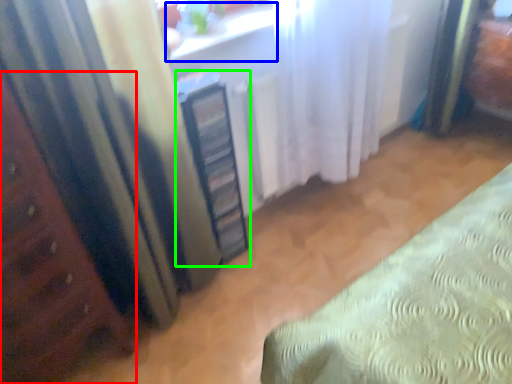
Question: Which object is the closest to the furniture (highlighted by a red box)? Choose among these: window sill (highlighted by a blue box) or cabinetry (highlighted by a green box).

Choices:
 (A) window sill
 (B) cabinetry

Answer: (B)